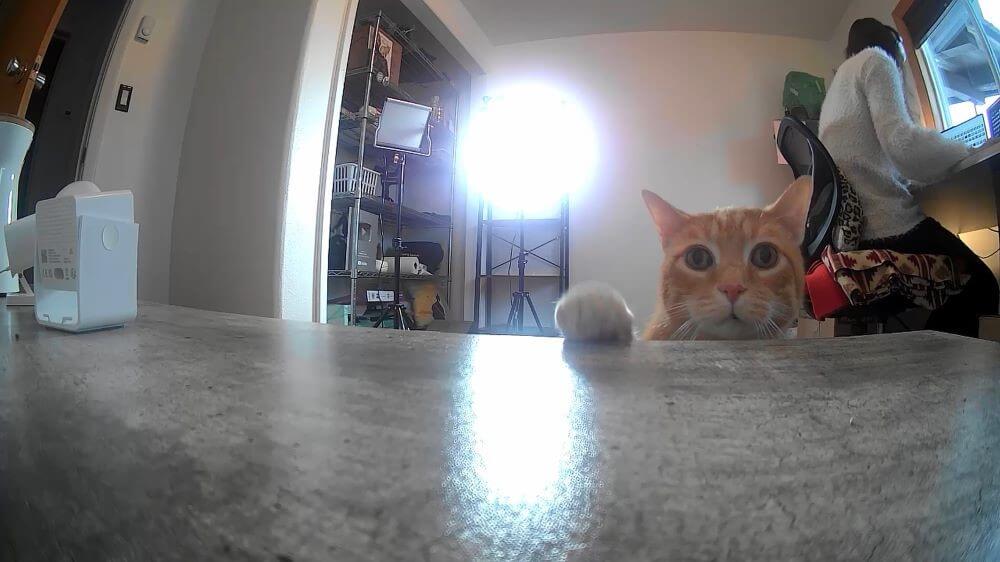
This screenshot has width=1000, height=562. Identify the location of laptop computers. (973, 135), (996, 126).